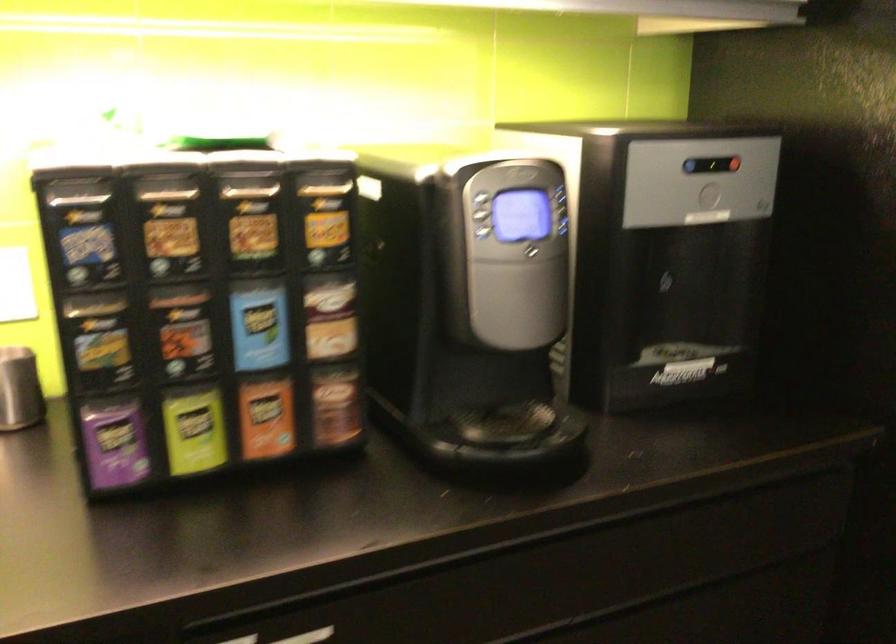
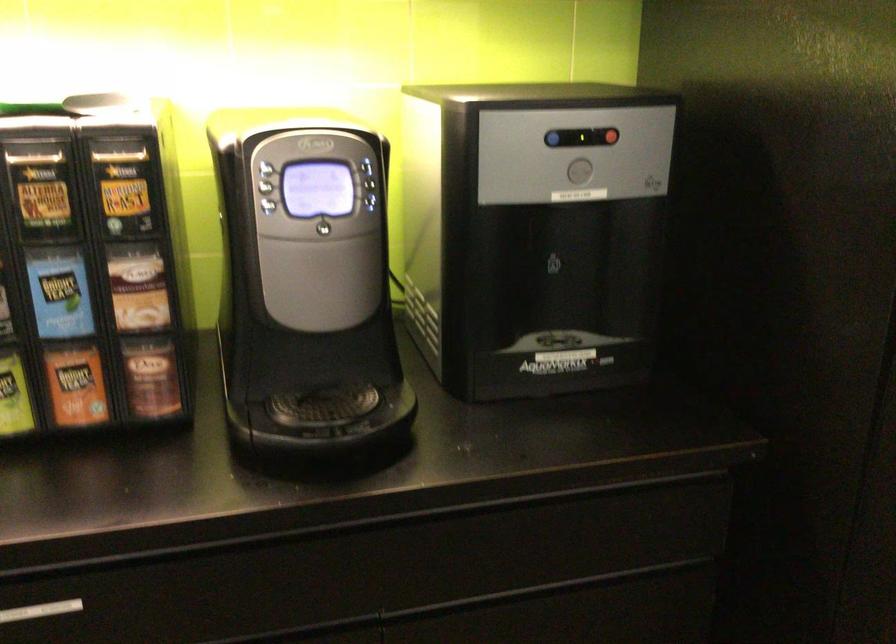
The point at (688, 165) is marked in the first image. Where is the corresponding point in the second image?

(552, 138)